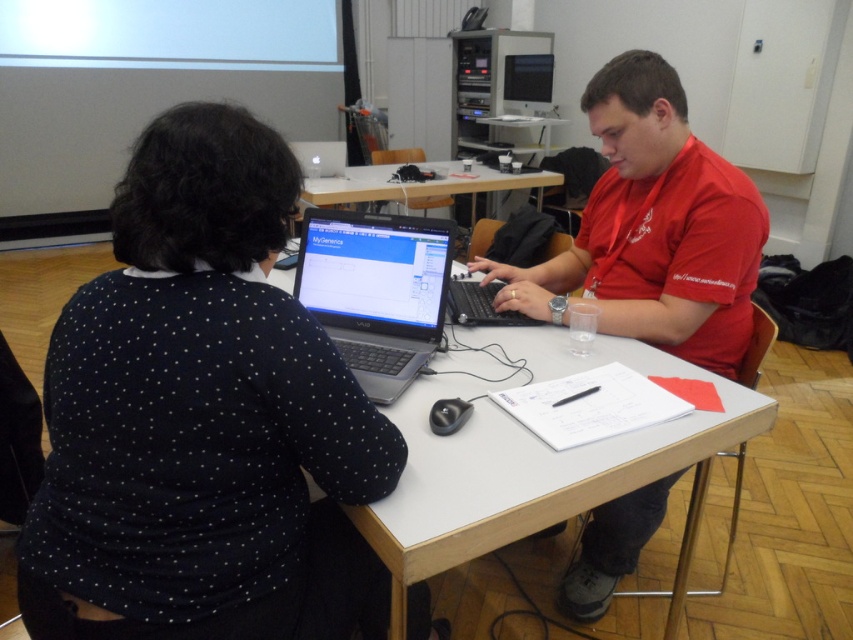
In the scene shown: You are a student trying to place a new laptop on the table in the classroom. The table has a coordinate system where the bottom left corner is the origin. The existing laptop is at point [376,291]. If you want to place your laptop 0.1 units to the right and 0.05 units above the existing laptop, what are the coordinates for your new laptop?

The new coordinates would be calculated by adding 0.1 to the x value and 0.05 to the y value of the existing laptop at point [376,291]. Therefore, the new coordinates are 0.555, 0.492.

You are standing in front of the table in the classroom. There are two points marked on the table surface. The first point is at coordinates point (450, 234) and the second point is at point (511, 182). If you want to place a small object closer to the camera, which point should you choose?

You should choose point (450, 234) because it is closer to the camera than point (511, 182).

You are standing in the classroom and want to hand a note to the person wearing the black dotted sweater at center. Which direction should you approach from to reach them?

The black dotted sweater at center is located at point 0.655 on the x axis and 0.238 on the y axis. Since the person is facing away from the camera, you should approach from the front to reach them.